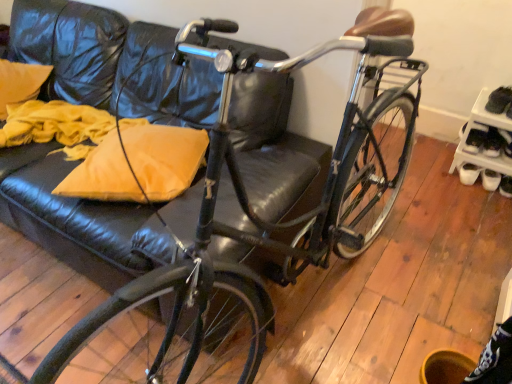
Question: Considering the relative sizes of matte yellow pillow at left and black leather shoe at lower right in the image provided, is matte yellow pillow at left shorter than black leather shoe at lower right?

Choices:
 (A) no
 (B) yes

Answer: (A)

Question: From a real-world perspective, is matte yellow pillow at left located higher than black leather shoe at lower right?

Choices:
 (A) no
 (B) yes

Answer: (B)

Question: Is matte yellow pillow at left outside of black leather shoe at lower right?

Choices:
 (A) yes
 (B) no

Answer: (A)

Question: From the image's perspective, does matte yellow pillow at left appear lower than black leather shoe at lower right?

Choices:
 (A) no
 (B) yes

Answer: (A)

Question: Is matte yellow pillow at left next to black leather shoe at lower right and touching it?

Choices:
 (A) yes
 (B) no

Answer: (B)

Question: From a real-world perspective, is black leather shoe at right physically located above or below white plastic shoe rack at right?

Choices:
 (A) below
 (B) above

Answer: (A)

Question: Relative to white plastic shoe rack at right, is black leather shoe at right in front or behind?

Choices:
 (A) front
 (B) behind

Answer: (B)

Question: In terms of height, does black leather shoe at right look taller or shorter compared to white plastic shoe rack at right?

Choices:
 (A) short
 (B) tall

Answer: (A)

Question: Is black leather shoe at right situated inside white plastic shoe rack at right or outside?

Choices:
 (A) inside
 (B) outside

Answer: (A)

Question: From a real-world perspective, is white plastic shoe rack at right above or below matte yellow pillow at left?

Choices:
 (A) above
 (B) below

Answer: (B)

Question: Would you say white plastic shoe rack at right is to the left or to the right of matte yellow pillow at left in the picture?

Choices:
 (A) left
 (B) right

Answer: (B)

Question: Considering their positions, is white plastic shoe rack at right located in front of or behind matte yellow pillow at left?

Choices:
 (A) behind
 (B) front

Answer: (A)

Question: In terms of size, does white plastic shoe rack at right appear bigger or smaller than matte yellow pillow at left?

Choices:
 (A) big
 (B) small

Answer: (A)

Question: Does point (507, 148) appear closer or farther from the camera than point (9, 92)?

Choices:
 (A) farther
 (B) closer

Answer: (A)

Question: Is black leather shoe at right in front of or behind yellow fabric pillow at upper left in the image?

Choices:
 (A) behind
 (B) front

Answer: (A)